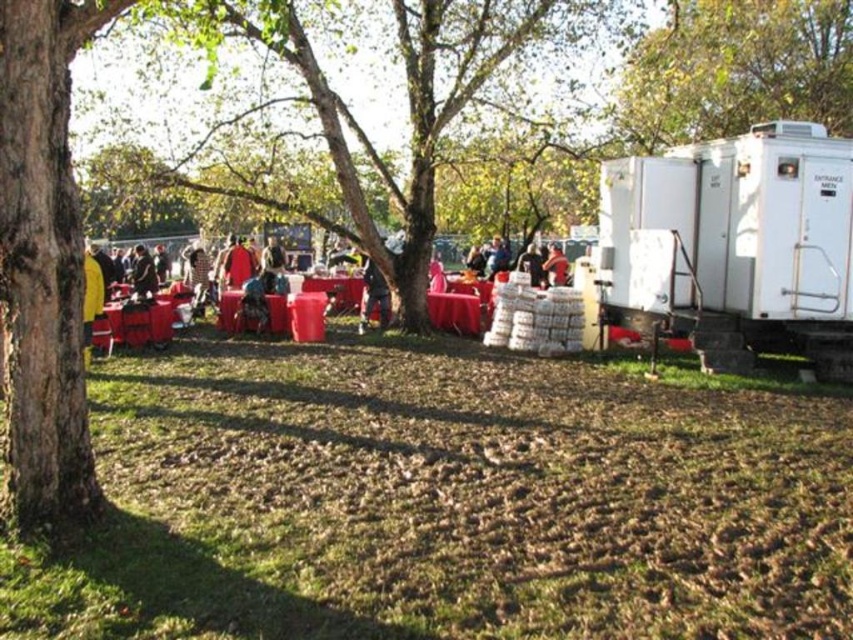
Question: Does white plastic camper at right appear on the left side of smooth red table at center?

Choices:
 (A) no
 (B) yes

Answer: (A)

Question: Which of the following is the closest to the observer?

Choices:
 (A) matte plastic table at center
 (B) matte black jacket at center

Answer: (A)

Question: Which of these objects is positioned farthest from the brown soil at lower center?

Choices:
 (A) white plastic camper at right
 (B) dark gray fabric jacket at center
 (C) matte red coat at center
 (D) matte plastic table at center

Answer: (B)

Question: Can you confirm if matte red coat at center is positioned above matte red jacket at center?

Choices:
 (A) yes
 (B) no

Answer: (B)

Question: Which point appears farthest from the camera in this image?

Choices:
 (A) (126, 589)
 (B) (236, 253)
 (C) (136, 280)

Answer: (B)

Question: Where is dark blue jeans at center located in relation to matte black jacket at center in the image?

Choices:
 (A) right
 (B) left

Answer: (B)